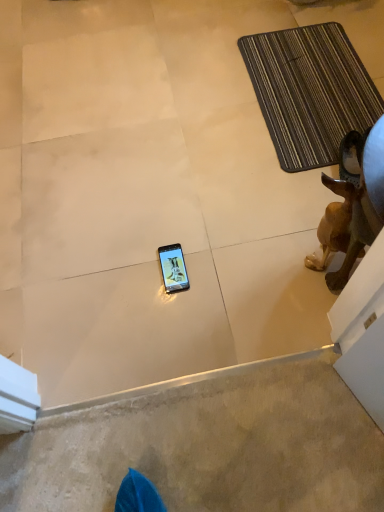
What are the coordinates of `smooth beige carpet at lower center` in the screenshot? It's located at (209, 446).

In order to face brown matte dog at right, should I rotate leftwards or rightwards?

You should look right and rotate roughly 18.201 degrees.

Where is `smooth beige carpet at lower center`? smooth beige carpet at lower center is located at coordinates (209, 446).

Is brown matte dog at right situated inside smooth beige carpet at lower center or outside?

brown matte dog at right exists outside the volume of smooth beige carpet at lower center.

Consider the image. Is brown matte dog at right facing away from smooth beige carpet at lower center?

No, brown matte dog at right is not facing the opposite direction of smooth beige carpet at lower center.

From the image's perspective, is brown matte dog at right on top of smooth beige carpet at lower center?

Indeed, from the image's perspective, brown matte dog at right is shown above smooth beige carpet at lower center.

Considering the sizes of objects brown matte dog at right and smooth beige carpet at lower center in the image provided, who is thinner, brown matte dog at right or smooth beige carpet at lower center?

brown matte dog at right is thinner.

This screenshot has height=512, width=384. In order to click on dog in front of the brown striped bath mat at upper right in this screenshot , I will do `click(340, 232)`.

Does point (277, 155) appear closer or farther from the camera than point (332, 189)?

Point (277, 155) is farther from the camera than point (332, 189).

Is brown striped bath mat at upper right looking in the opposite direction of brown matte dog at right?

No, brown striped bath mat at upper right's orientation is not away from brown matte dog at right.

Which of these two, brown striped bath mat at upper right or brown matte dog at right, is wider?

brown striped bath mat at upper right is wider.

Could you tell me if brown striped bath mat at upper right is facing smooth beige carpet at lower center?

No, brown striped bath mat at upper right does not turn towards smooth beige carpet at lower center.

Consider the image. What's the angular difference between brown striped bath mat at upper right and smooth beige carpet at lower center's facing directions?

There is a 88.6-degree angle between the facing directions of brown striped bath mat at upper right and smooth beige carpet at lower center.

Which object is further away from the camera, brown striped bath mat at upper right or smooth beige carpet at lower center?

brown striped bath mat at upper right.

Which is in front, point (353, 250) or point (301, 140)?

The point (353, 250) is more forward.

Is brown matte dog at right taller or shorter than brown striped bath mat at upper right?

Clearly, brown matte dog at right is taller compared to brown striped bath mat at upper right.

Who is bigger, brown matte dog at right or brown striped bath mat at upper right?

Bigger between the two is brown striped bath mat at upper right.

Which is more to the right, smooth beige carpet at lower center or brown matte dog at right?

brown matte dog at right.

Considering the positions of objects smooth beige carpet at lower center and brown matte dog at right in the image provided, who is in front, smooth beige carpet at lower center or brown matte dog at right?

brown matte dog at right is closer to the camera.

Could you tell me if smooth beige carpet at lower center is turned towards brown matte dog at right?

No, smooth beige carpet at lower center is not facing towards brown matte dog at right.

Where is `concrete in front of the brown striped bath mat at upper right`? concrete in front of the brown striped bath mat at upper right is located at coordinates (209, 446).

Which is behind, smooth beige carpet at lower center or brown striped bath mat at upper right?

brown striped bath mat at upper right is further away from the camera.

Which object is wider, smooth beige carpet at lower center or brown striped bath mat at upper right?

With larger width is brown striped bath mat at upper right.

Find the location of a particular element. This screenshot has width=384, height=512. dog in front of the smooth beige carpet at lower center is located at coordinates (340, 232).

Where is `dog to the left of brown striped bath mat at upper right`? Image resolution: width=384 pixels, height=512 pixels. dog to the left of brown striped bath mat at upper right is located at coordinates (340, 232).

When comparing their distances from brown striped bath mat at upper right, does smooth beige carpet at lower center or brown matte dog at right seem further?

smooth beige carpet at lower center is positioned further to the anchor brown striped bath mat at upper right.

Estimate the real-world distances between objects in this image. Which object is closer to smooth beige carpet at lower center, brown matte dog at right or brown striped bath mat at upper right?

Among the two, brown matte dog at right is located nearer to smooth beige carpet at lower center.

Considering their positions, is brown matte dog at right positioned further to brown striped bath mat at upper right than smooth beige carpet at lower center?

smooth beige carpet at lower center lies further to brown striped bath mat at upper right than the other object.

Estimate the real-world distances between objects in this image. Which object is closer to brown matte dog at right, smooth beige carpet at lower center or brown striped bath mat at upper right?

smooth beige carpet at lower center lies closer to brown matte dog at right than the other object.

Based on their spatial positions, is brown striped bath mat at upper right or smooth beige carpet at lower center closer to brown matte dog at right?

smooth beige carpet at lower center lies closer to brown matte dog at right than the other object.

From the image, which object appears to be nearer to smooth beige carpet at lower center, brown striped bath mat at upper right or brown matte dog at right?

brown matte dog at right is closer to smooth beige carpet at lower center.

Where is `dog between brown striped bath mat at upper right and smooth beige carpet at lower center from top to bottom`? dog between brown striped bath mat at upper right and smooth beige carpet at lower center from top to bottom is located at coordinates pos(340,232).